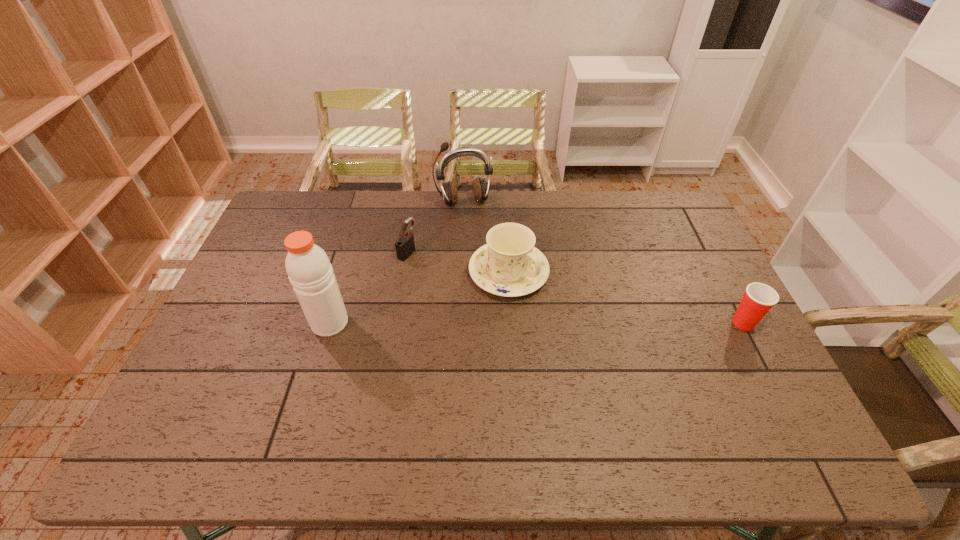
Find the location of `vacant space located 0.390m with the keyhole on the front of the padlock`. vacant space located 0.390m with the keyhole on the front of the padlock is located at coordinates (521, 301).

Find the location of a particular element. This screenshot has height=540, width=960. blank area located with the keyhole on the front of the padlock is located at coordinates (454, 273).

This screenshot has height=540, width=960. Find the location of `free space located on the ear pads of the earphone`. free space located on the ear pads of the earphone is located at coordinates (477, 238).

Locate an element on the screen. The width and height of the screenshot is (960, 540). vacant space located on the ear pads of the earphone is located at coordinates (486, 268).

At what (x,y) coordinates should I click in order to perform the action: click on free space located 0.110m on the ear pads of the earphone. Please return your answer as a coordinate pair (x, y). The image size is (960, 540). Looking at the image, I should click on (475, 231).

You are a GUI agent. You are given a task and a screenshot of the screen. Output one action in this format:
    pyautogui.click(x=<x>, y=<y>)
    Task: Click on the free location located 0.140m on the handle side of the chinaware
    
    Given the screenshot: What is the action you would take?
    pyautogui.click(x=577, y=319)

Identify the location of vacant region located 0.270m on the handle side of the chinaware. The width and height of the screenshot is (960, 540). (615, 345).

Image resolution: width=960 pixels, height=540 pixels. In order to click on vacant area situated on the handle side of the chinaware in this screenshot , I will do `click(652, 369)`.

At what (x,y) coordinates should I click in order to perform the action: click on object that is at the far edge. Please return your answer as a coordinate pair (x, y). This screenshot has height=540, width=960. Looking at the image, I should click on (480, 189).

Locate an element on the screen. object that is at the right edge is located at coordinates (759, 298).